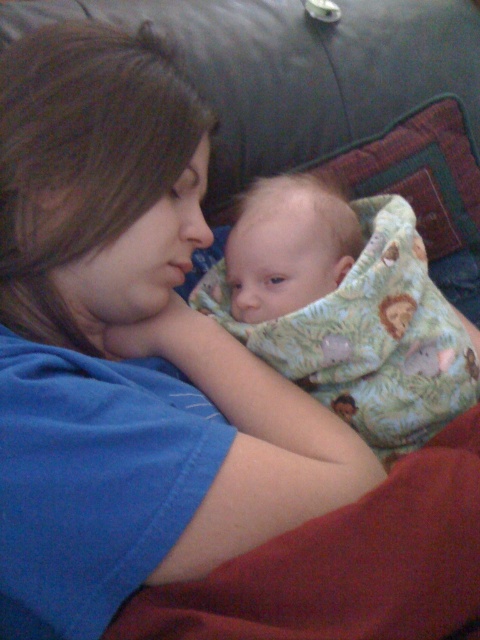
Based on the photo, is soft green fabric baby at center positioned at the back of soft red blanket at lower right?

That is True.

Who is more forward, [383,449] or [412,577]?

Point [412,577] is more forward.

What are the coordinates of `soft green fabric baby at center` in the screenshot? It's located at (345, 308).